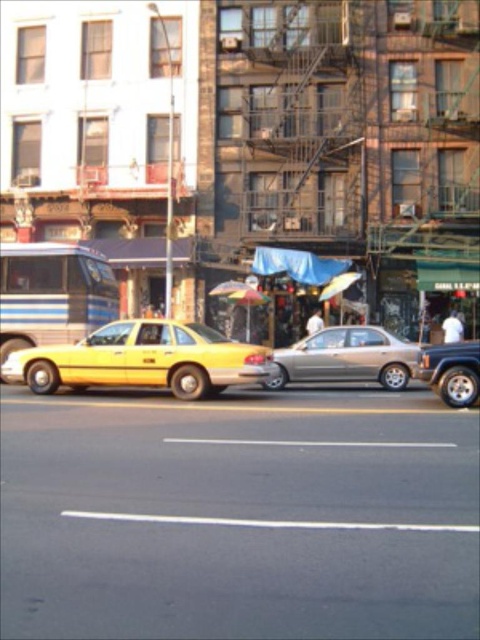
Is shiny yellow taxi at center bigger than satin gold sedan at center?

No, shiny yellow taxi at center is not bigger than satin gold sedan at center.

Between shiny yellow taxi at center and satin gold sedan at center, which one is positioned higher?

Positioned higher is satin gold sedan at center.

Does point (222, 384) come in front of point (376, 372)?

That is True.

Image resolution: width=480 pixels, height=640 pixels. In order to click on shiny yellow taxi at center in this screenshot , I will do `click(144, 358)`.

Can you confirm if shiny yellow taxi at center is positioned to the right of metallic silver suv at right?

No, shiny yellow taxi at center is not to the right of metallic silver suv at right.

Who is shorter, shiny yellow taxi at center or metallic silver suv at right?

Standing shorter between the two is shiny yellow taxi at center.

Does point (219, 348) come closer to viewer compared to point (479, 362)?

That is False.

The height and width of the screenshot is (640, 480). I want to click on shiny yellow taxi at center, so click(144, 358).

This screenshot has width=480, height=640. What do you see at coordinates (453, 371) in the screenshot? I see `metallic silver suv at right` at bounding box center [453, 371].

Which is above, metallic silver suv at right or translucent plastic umbrella at center?

translucent plastic umbrella at center is higher up.

Does point (474, 369) come closer to viewer compared to point (250, 316)?

That is True.

At what (x,y) coordinates should I click in order to perform the action: click on metallic silver suv at right. Please return your answer as a coordinate pair (x, y). The height and width of the screenshot is (640, 480). Looking at the image, I should click on (453, 371).